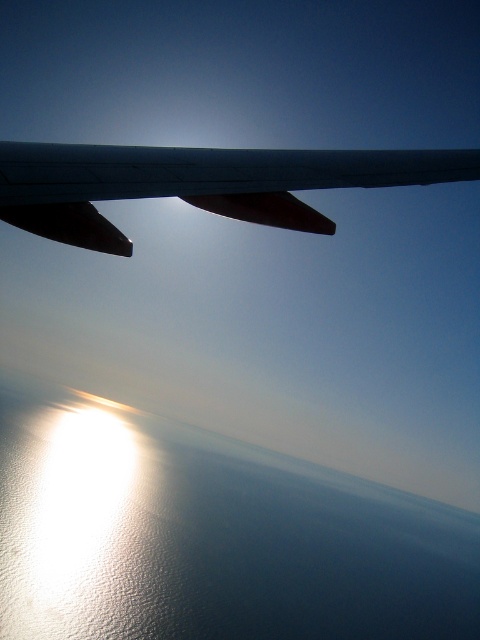
Question: Does glistening blue water at bottom left lie in front of metallic gray wing at upper center?

Choices:
 (A) yes
 (B) no

Answer: (B)

Question: In this image, where is glistening blue water at bottom left located relative to metallic gray wing at upper center?

Choices:
 (A) right
 (B) left

Answer: (A)

Question: Which of the following is the farthest from the observer?

Choices:
 (A) (308, 156)
 (B) (197, 500)

Answer: (B)

Question: Is glistening blue water at bottom left thinner than metallic gray wing at upper center?

Choices:
 (A) yes
 (B) no

Answer: (B)